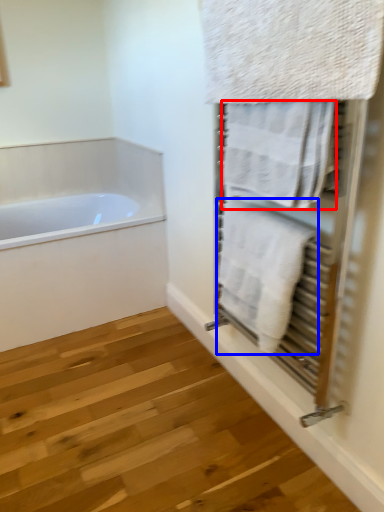
Question: Which point is closer to the camera, towel (highlighted by a red box) or towel (highlighted by a blue box)?

Choices:
 (A) towel
 (B) towel

Answer: (A)